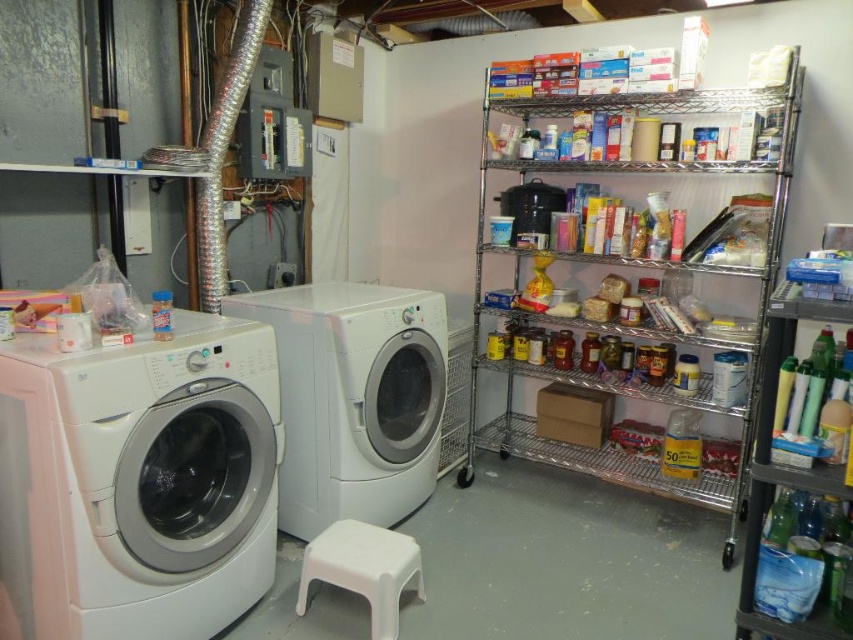
You are trying to decide whether to place a new laundry basket between the white glossy washing machine at center and the white plastic stool at lower center. Considering their heights, which object should be placed on top of the other to maximize storage space?

The white glossy washing machine at center is much taller than the white plastic stool at lower center, so the stool can be placed on top of the washing machine to maximize storage space.

You are standing in the utility room and want to reach the white glossy washing machine at center. Considering the stool is 2.5 feet tall, can you step on it to touch the top of the washing machine?

The white glossy washing machine at center is 7.58 feet from viewer. The stool is 2.5 feet tall, so if you step on it, you can reach up to 2.5 feet higher. Therefore, you can touch the top of the washing machine if your height plus the stool allows you to reach 7.58 feet.

You are organizing the utility room and need to move the white plastic stool at lower center to the right side. Can the metallic wire shelving at right accommodate the stool in terms of width?

The metallic wire shelving at right is wider than the white plastic stool at lower center, so yes, the stool can fit within the shelving unit in terms of width.